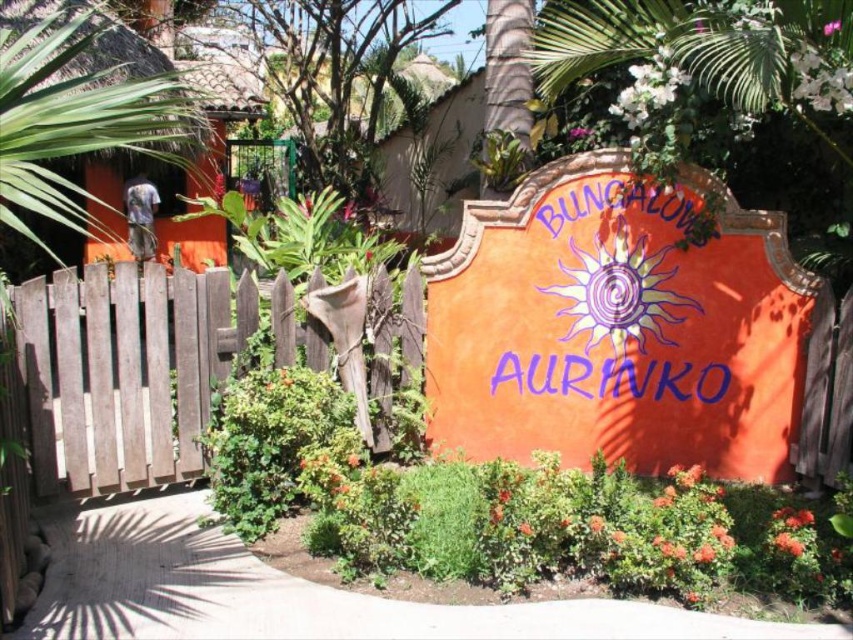
Between point (438, 368) and point (635, 371), which one is positioned behind?

Positioned behind is point (438, 368).

Does orange stucco sign at center have a larger size compared to purple painted sign at center?

Yes, orange stucco sign at center is bigger than purple painted sign at center.

This screenshot has height=640, width=853. I want to click on orange stucco sign at center, so click(x=618, y=326).

Does weathered wood gate at left have a lesser height compared to purple painted sign at center?

Incorrect, weathered wood gate at left's height does not fall short of purple painted sign at center's.

Between point (57, 355) and point (631, 380), which one is positioned in front?

Point (57, 355)

You are a GUI agent. You are given a task and a screenshot of the screen. Output one action in this format:
    pyautogui.click(x=<x>, y=<y>)
    Task: Click on the weathered wood gate at left
    This screenshot has height=640, width=853.
    Given the screenshot: What is the action you would take?
    pyautogui.click(x=123, y=371)

Does purple painted sign at center come in front of pink matte flower at center?

No, it is not.

Find the location of a particular element. This screenshot has width=853, height=640. purple painted sign at center is located at coordinates (612, 378).

At what (x,y) coordinates should I click in order to perform the action: click on purple painted sign at center. Please return your answer as a coordinate pair (x, y). This screenshot has height=640, width=853. Looking at the image, I should click on (612, 378).